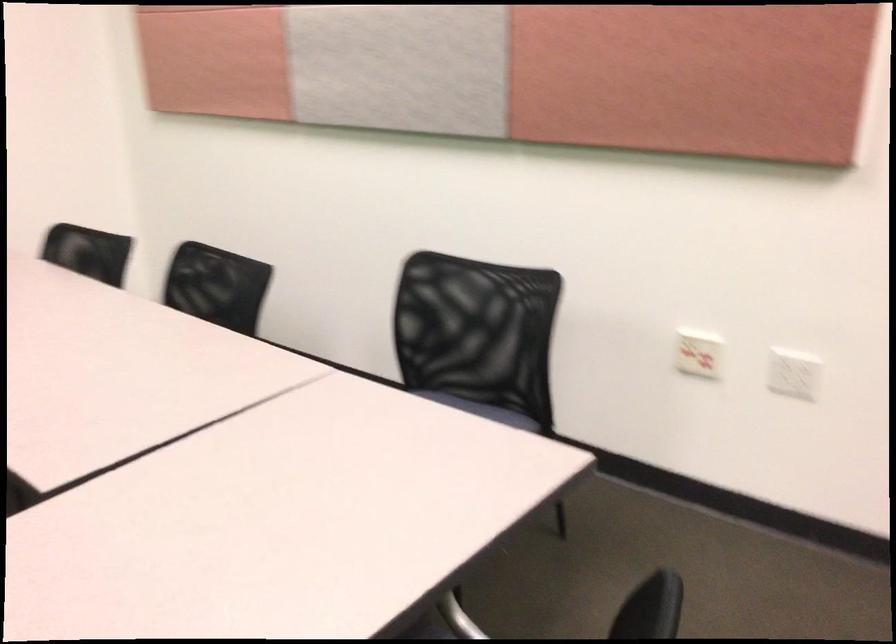
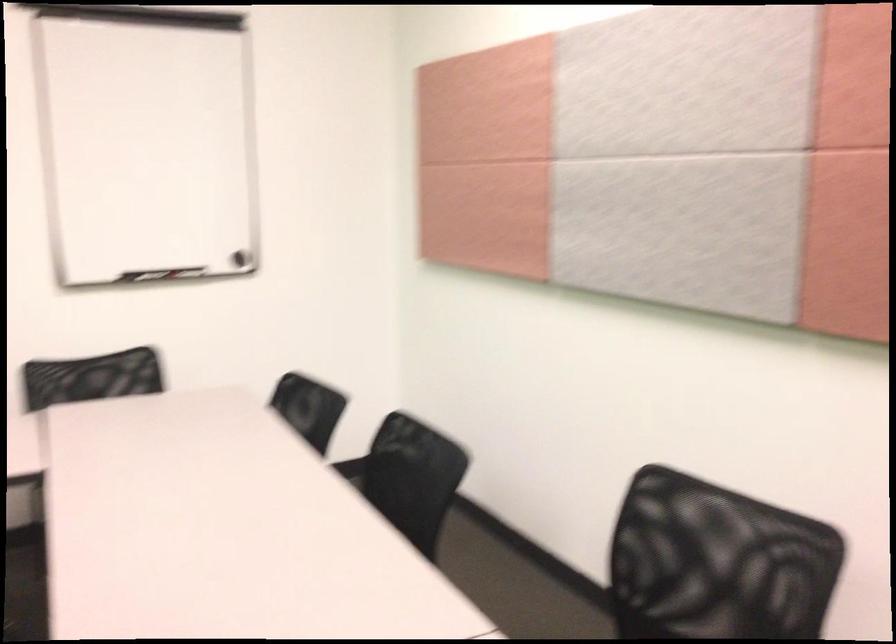
Question: What movement of the cameraman would produce the second image?

Choices:
 (A) Left
 (B) Right
 (C) Forward
 (D) Backward

Answer: (C)